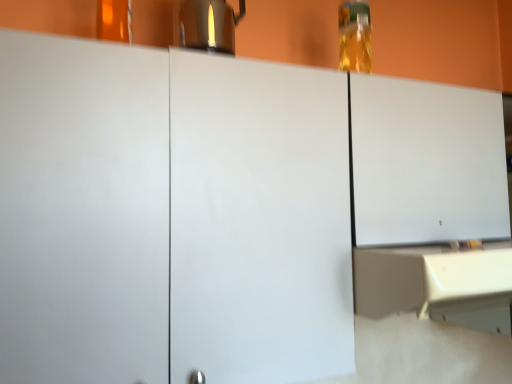
Question: Does point (198, 48) appear closer or farther from the camera than point (355, 39)?

Choices:
 (A) farther
 (B) closer

Answer: (A)

Question: Is satin silver coffee pot at upper center in front of or behind translucent glass bottle at upper right in the image?

Choices:
 (A) behind
 (B) front

Answer: (B)

Question: Which object is positioned farthest from the satin silver coffee pot at upper center?

Choices:
 (A) translucent glass bottle at upper right
 (B) beige matte counter at lower right

Answer: (B)

Question: Considering the real-world distances, which object is closest to the satin silver coffee pot at upper center?

Choices:
 (A) beige matte counter at lower right
 (B) translucent glass bottle at upper right

Answer: (B)